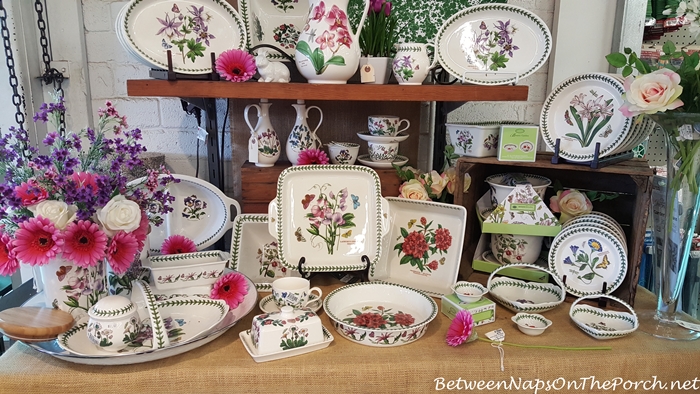
Locate an element on the screen. wood stand is located at coordinates (594, 169).